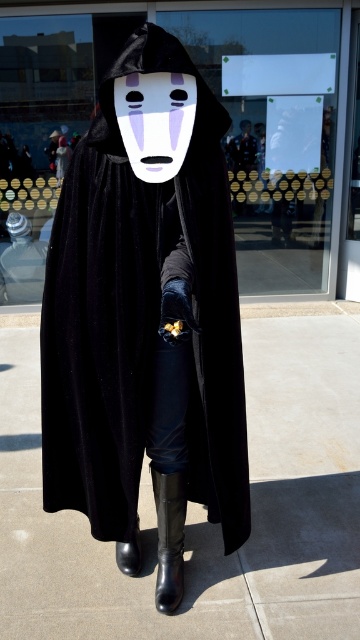
Is black velvet cloak at center wider than white matte mask at center?

Yes, black velvet cloak at center is wider than white matte mask at center.

This screenshot has height=640, width=360. What do you see at coordinates (141, 316) in the screenshot?
I see `black velvet cloak at center` at bounding box center [141, 316].

Locate an element on the screen. This screenshot has width=360, height=640. black velvet cloak at center is located at coordinates (141, 316).

In order to click on black velvet cloak at center in this screenshot , I will do `click(141, 316)`.

How distant is black velvet cloak at center from black rubber boot at lower center?

The distance of black velvet cloak at center from black rubber boot at lower center is 16.27 inches.

Can you confirm if black velvet cloak at center is wider than black rubber boot at lower center?

Indeed, black velvet cloak at center has a greater width compared to black rubber boot at lower center.

Between point (244, 413) and point (178, 541), which one is positioned behind?

The point (178, 541) is behind.

In order to click on black velvet cloak at center in this screenshot , I will do `click(141, 316)`.

Is white matte mask at center above black rubber boot at lower center?

Yes.

Is point (124, 136) farther from viewer compared to point (168, 486)?

No, (124, 136) is in front of (168, 486).

Is point (137, 147) positioned in front of point (168, 483)?

Yes, point (137, 147) is in front of point (168, 483).

Find the location of a particular element. white matte mask at center is located at coordinates (155, 122).